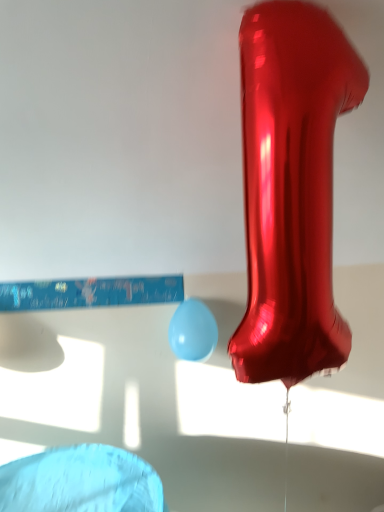
Image resolution: width=384 pixels, height=512 pixels. Describe the element at coordinates (193, 331) in the screenshot. I see `light blue glossy balloon at center` at that location.

I want to click on light blue glossy balloon at center, so click(x=193, y=331).

Where is `shiny metallic number one at center`? The height and width of the screenshot is (512, 384). shiny metallic number one at center is located at coordinates (291, 189).

What do you see at coordinates (291, 189) in the screenshot? Image resolution: width=384 pixels, height=512 pixels. I see `shiny metallic number one at center` at bounding box center [291, 189].

At what (x,y) coordinates should I click in order to perform the action: click on light blue glossy balloon at center. Please return your answer as a coordinate pair (x, y). The width and height of the screenshot is (384, 512). Looking at the image, I should click on (193, 331).

Which is more to the right, light blue glossy balloon at center or shiny metallic number one at center?

Positioned to the right is shiny metallic number one at center.

Which object is closer to the camera, light blue glossy balloon at center or shiny metallic number one at center?

Positioned in front is shiny metallic number one at center.

Between point (191, 327) and point (336, 355), which one is positioned behind?

Positioned behind is point (191, 327).

From the image's perspective, would you say light blue glossy balloon at center is shown under shiny metallic number one at center?

Yes, from the image's perspective, light blue glossy balloon at center is below shiny metallic number one at center.

From a real-world perspective, is light blue glossy balloon at center below shiny metallic number one at center?

Indeed, from a real-world perspective, light blue glossy balloon at center is positioned beneath shiny metallic number one at center.

Considering the sizes of objects light blue glossy balloon at center and shiny metallic number one at center in the image provided, who is thinner, light blue glossy balloon at center or shiny metallic number one at center?

light blue glossy balloon at center.

Between light blue glossy balloon at center and shiny metallic number one at center, which one has more height?

With more height is shiny metallic number one at center.

Who is smaller, light blue glossy balloon at center or shiny metallic number one at center?

Smaller between the two is light blue glossy balloon at center.

Is light blue glossy balloon at center spatially inside shiny metallic number one at center, or outside of it?

light blue glossy balloon at center is not inside shiny metallic number one at center, it's outside.

Is light blue glossy balloon at center beside shiny metallic number one at center?

No, light blue glossy balloon at center is not making contact with shiny metallic number one at center.

Is light blue glossy balloon at center looking in the opposite direction of shiny metallic number one at center?

That's not correct — light blue glossy balloon at center is not looking away from shiny metallic number one at center.

Identify the location of balloon that appears below the shiny metallic number one at center (from a real-world perspective). (193, 331).

Does shiny metallic number one at center appear on the left side of light blue glossy balloon at center?

Incorrect, shiny metallic number one at center is not on the left side of light blue glossy balloon at center.

Which object is further away from the camera taking this photo, shiny metallic number one at center or light blue glossy balloon at center?

Positioned behind is light blue glossy balloon at center.

Is point (240, 329) in front of point (203, 352)?

Yes, it is in front of point (203, 352).

From the image's perspective, does shiny metallic number one at center appear higher than light blue glossy balloon at center?

Indeed, from the image's perspective, shiny metallic number one at center is shown above light blue glossy balloon at center.

From a real-world perspective, is shiny metallic number one at center physically above light blue glossy balloon at center?

Yes.

Between shiny metallic number one at center and light blue glossy balloon at center, which one has smaller width?

Thinner between the two is light blue glossy balloon at center.

Considering the sizes of shiny metallic number one at center and light blue glossy balloon at center in the image, is shiny metallic number one at center taller or shorter than light blue glossy balloon at center?

In the image, shiny metallic number one at center appears to be taller than light blue glossy balloon at center.

Which of these two, shiny metallic number one at center or light blue glossy balloon at center, is smaller?

Smaller between the two is light blue glossy balloon at center.

Is light blue glossy balloon at center inside shiny metallic number one at center?

No, light blue glossy balloon at center is not surrounded by shiny metallic number one at center.

Would you say shiny metallic number one at center is a long distance from light blue glossy balloon at center?

shiny metallic number one at center is actually quite close to light blue glossy balloon at center.

Is shiny metallic number one at center looking in the opposite direction of light blue glossy balloon at center?

Yes, shiny metallic number one at center's orientation is away from light blue glossy balloon at center.

Measure the distance between shiny metallic number one at center and light blue glossy balloon at center.

They are 27.86 inches apart.

Where is `footwear above the light blue glossy balloon at center (from a real-world perspective)`? The image size is (384, 512). footwear above the light blue glossy balloon at center (from a real-world perspective) is located at coordinates (291, 189).

Locate an element on the screen. The height and width of the screenshot is (512, 384). footwear on the right of the light blue glossy balloon at center is located at coordinates (291, 189).

The width and height of the screenshot is (384, 512). There is a light blue glossy balloon at center. Find the location of `footwear above it (from a real-world perspective)`. footwear above it (from a real-world perspective) is located at coordinates (291, 189).